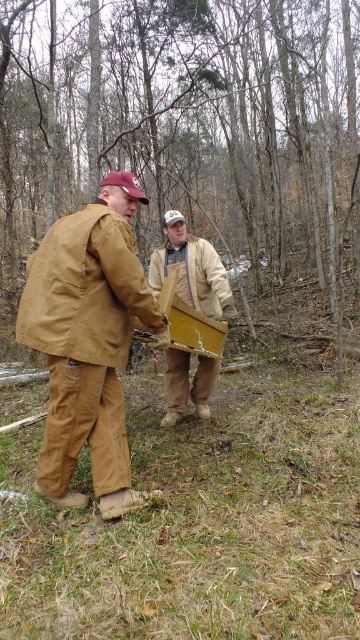
Is brown wood tree at center smaller than wooden crate at center?

Actually, brown wood tree at center might be larger than wooden crate at center.

What do you see at coordinates (187, 124) in the screenshot? I see `brown wood tree at center` at bounding box center [187, 124].

Where is `brown wood tree at center`? This screenshot has width=360, height=640. brown wood tree at center is located at coordinates (187, 124).

Measure the distance between brown canvas jacket at left and camera.

They are 2.59 meters apart.

Is point (84, 269) more distant than point (200, 275)?

No, it is not.

Find the location of a particular element. brown canvas jacket at left is located at coordinates (87, 342).

Does brown wood tree at center have a greater width compared to brown canvas jacket at left?

Correct, the width of brown wood tree at center exceeds that of brown canvas jacket at left.

Between point (145, 145) and point (47, 490), which one is positioned in front?

Positioned in front is point (47, 490).

This screenshot has height=640, width=360. I want to click on brown wood tree at center, so click(187, 124).